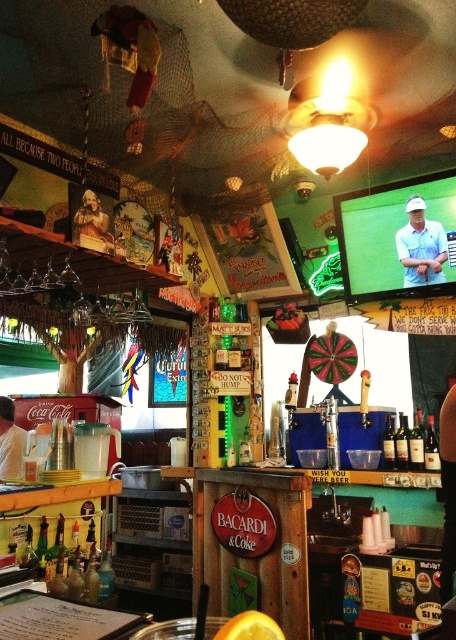
Question: Where is matte blue shirt at center located in relation to smooth wooden table at center in the image?

Choices:
 (A) below
 (B) above

Answer: (B)

Question: Does matte blue shirt at center appear under smooth wooden table at center?

Choices:
 (A) no
 (B) yes

Answer: (A)

Question: Does matte blue shirt at center have a greater width compared to smooth wooden table at center?

Choices:
 (A) no
 (B) yes

Answer: (A)

Question: Which object appears closest to the camera in this image?

Choices:
 (A) smooth wooden table at center
 (B) matte blue shirt at center

Answer: (B)

Question: Which object appears closest to the camera in this image?

Choices:
 (A) matte blue shirt at center
 (B) smooth wooden table at center

Answer: (A)

Question: Which of the following is the farthest from the observer?

Choices:
 (A) (1, 468)
 (B) (412, 244)

Answer: (A)